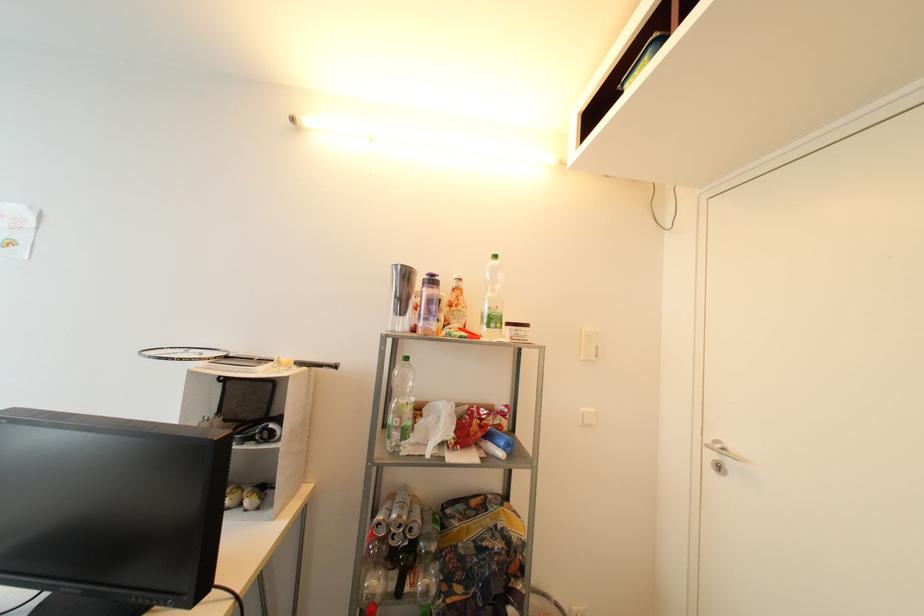
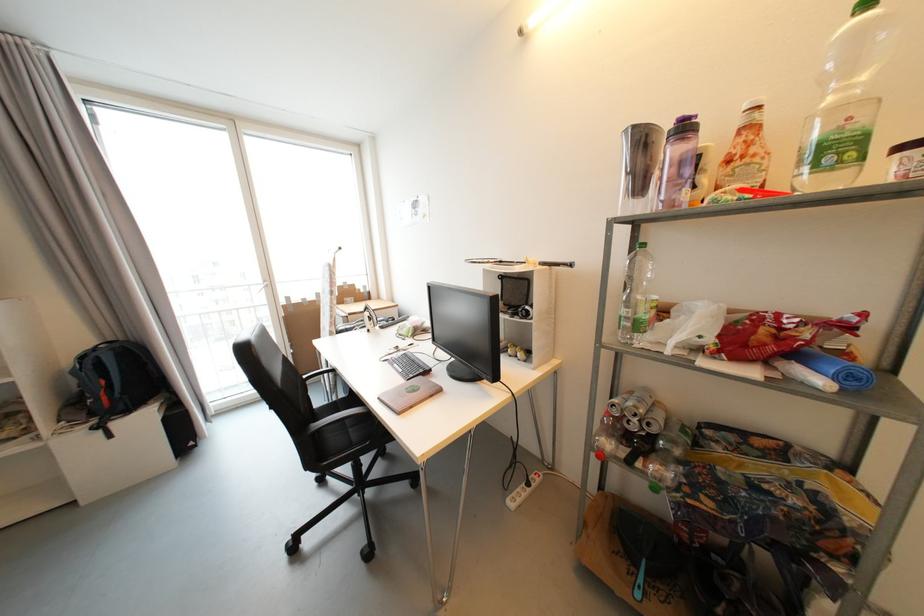
Locate, in the second image, the point that corresponds to point 407,268 in the first image.

(639, 129)